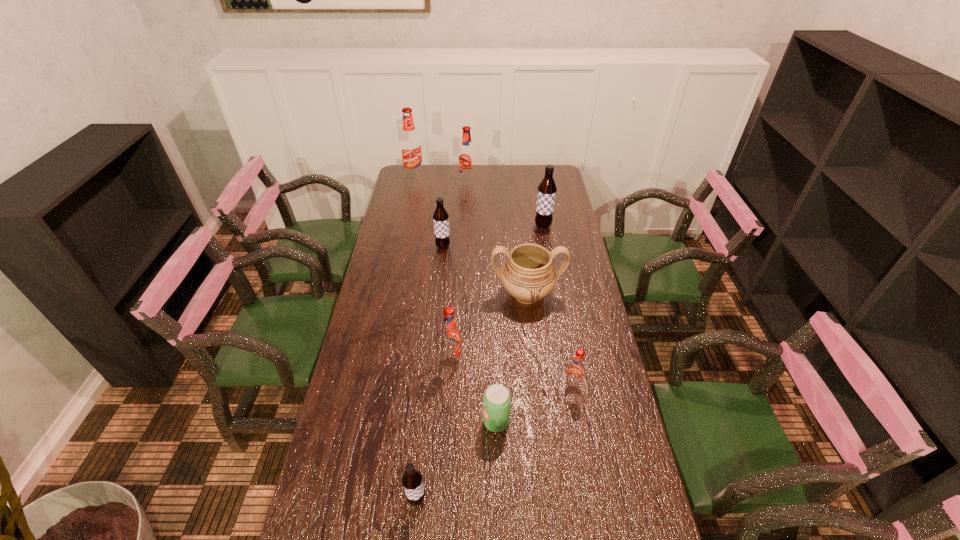
Find the location of `vacant space located 0.360m on the front of the fifth farthest root beer`. vacant space located 0.360m on the front of the fifth farthest root beer is located at coordinates (445, 480).

Image resolution: width=960 pixels, height=540 pixels. What are the coordinates of `vacant area situated on the front-facing side of the fifth farthest object` in the screenshot? It's located at (532, 343).

Identify the location of vacant space located 0.190m on the left of the seventh farthest object. (504, 387).

Find the location of a particular element. The image size is (960, 540). free spot located 0.190m on the right of the nearest brown root beer is located at coordinates (500, 498).

You are a GUI agent. You are given a task and a screenshot of the screen. Output one action in this format:
    pyautogui.click(x=<x>, y=<y>)
    Task: Click on the vacant space located on the front of the shortest object
    
    Given the screenshot: What is the action you would take?
    tap(497, 472)

Where is `object at the left edge`? Image resolution: width=960 pixels, height=540 pixels. object at the left edge is located at coordinates (410, 143).

The width and height of the screenshot is (960, 540). Find the location of `urn at the right edge`. urn at the right edge is located at coordinates (529, 274).

Find the location of `object at the far left corner`. object at the far left corner is located at coordinates (410, 143).

At what (x,y) coordinates should I click in order to perform the action: click on free spot at the far edge of the desktop. Please return your answer as a coordinate pair (x, y). Looking at the image, I should click on (451, 168).

Locate an element on the screen. vacant space at the left edge is located at coordinates (388, 422).